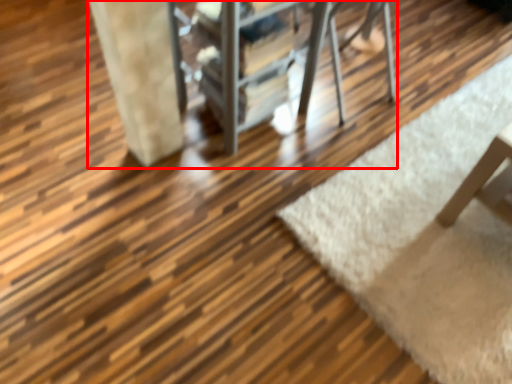
Question: From the image's perspective, where is furniture (annotated by the red box) located in relation to mat in the image?

Choices:
 (A) below
 (B) above

Answer: (B)